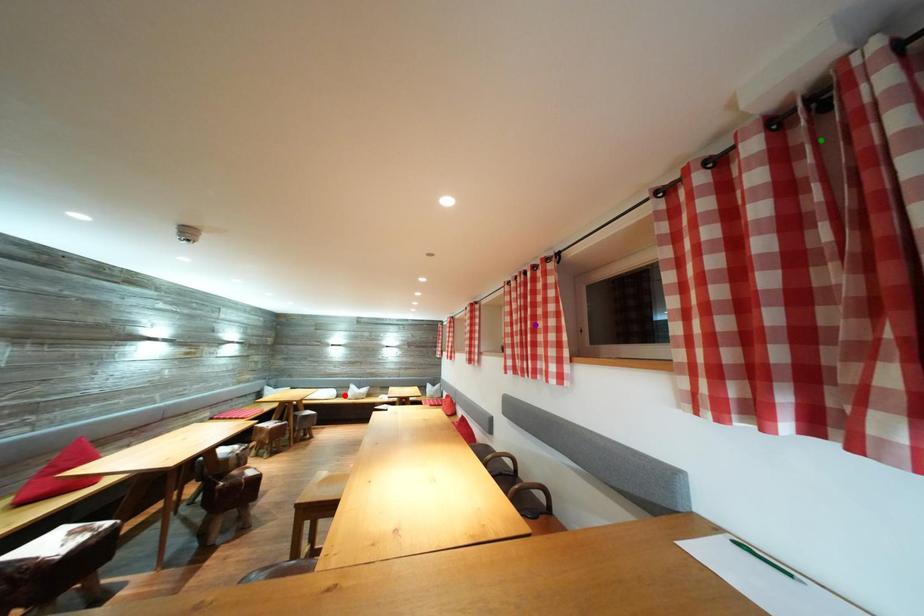
Order these from nearest to farthest:
1. red point
2. purple point
3. green point

green point, purple point, red point